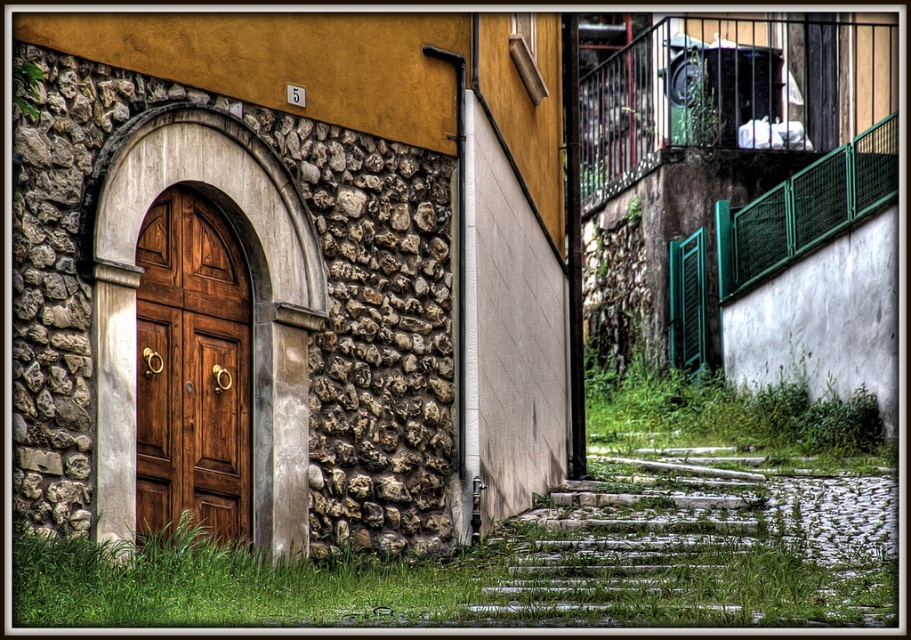
Does point (179, 282) come farther from viewer compared to point (251, 525)?

No, (179, 282) is in front of (251, 525).

Which is in front, point (221, 372) or point (177, 429)?

Positioned in front is point (177, 429).

Where is `rustic stone wall at left`? This screenshot has width=911, height=640. rustic stone wall at left is located at coordinates (229, 320).